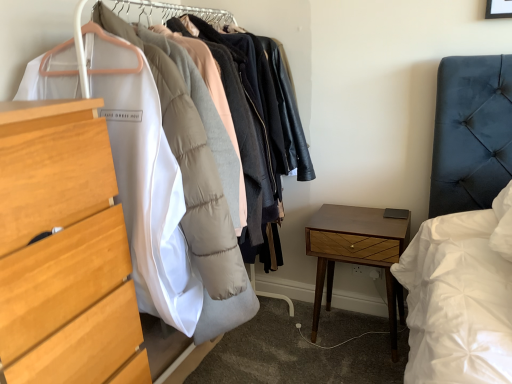
Question: From the image's perspective, is wooden nightstand at lower right beneath light wood chest of drawers at left?

Choices:
 (A) yes
 (B) no

Answer: (A)

Question: Is wooden nightstand at lower right thinner than light wood chest of drawers at left?

Choices:
 (A) no
 (B) yes

Answer: (B)

Question: Can you confirm if wooden nightstand at lower right is positioned to the left of light wood chest of drawers at left?

Choices:
 (A) no
 (B) yes

Answer: (A)

Question: Considering the relative positions of wooden nightstand at lower right and light wood chest of drawers at left in the image provided, is wooden nightstand at lower right to the right of light wood chest of drawers at left from the viewer's perspective?

Choices:
 (A) no
 (B) yes

Answer: (B)

Question: From the image's perspective, is wooden nightstand at lower right on light wood chest of drawers at left?

Choices:
 (A) no
 (B) yes

Answer: (A)

Question: From a real-world perspective, is wooden nightstand at lower right over light wood chest of drawers at left?

Choices:
 (A) no
 (B) yes

Answer: (A)

Question: Is light wood chest of drawers at left shorter than wooden nightstand at lower right?

Choices:
 (A) no
 (B) yes

Answer: (A)

Question: From the image's perspective, is light wood chest of drawers at left below wooden nightstand at lower right?

Choices:
 (A) no
 (B) yes

Answer: (A)

Question: Could wooden nightstand at lower right be considered to be inside light wood chest of drawers at left?

Choices:
 (A) yes
 (B) no

Answer: (B)

Question: From the image's perspective, is light wood chest of drawers at left on wooden nightstand at lower right?

Choices:
 (A) yes
 (B) no

Answer: (A)

Question: Can you confirm if light wood chest of drawers at left is positioned to the right of wooden nightstand at lower right?

Choices:
 (A) no
 (B) yes

Answer: (A)

Question: From a real-world perspective, is light wood chest of drawers at left positioned under wooden nightstand at lower right based on gravity?

Choices:
 (A) yes
 (B) no

Answer: (B)

Question: Is point (64, 319) closer or farther from the camera than point (394, 221)?

Choices:
 (A) farther
 (B) closer

Answer: (B)